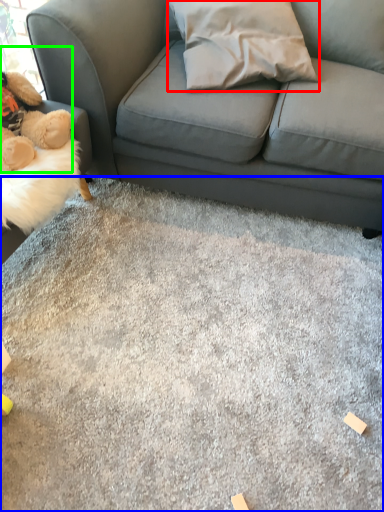
Question: Estimate the real-world distances between objects in this image. Which object is closer to throw pillow (highlighted by a red box), concrete (highlighted by a blue box) or toy (highlighted by a green box)?

Choices:
 (A) concrete
 (B) toy

Answer: (B)